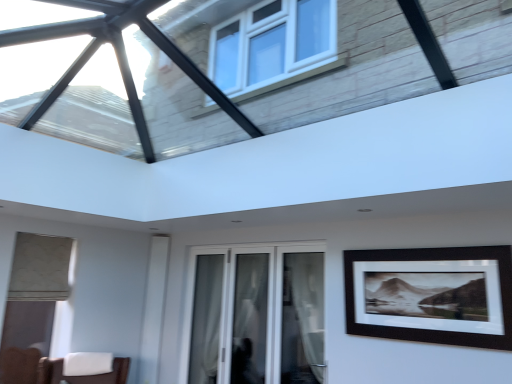
You are a GUI agent. You are given a task and a screenshot of the screen. Output one action in this format:
    pyautogui.click(x=<x>, y=<y>)
    Task: Click on the black matte picture frame at right
    The image size is (512, 384).
    Given the screenshot: What is the action you would take?
    pyautogui.click(x=431, y=295)

How much space does white sheer curtain at center, positioned as the second curtain in back-to-front order, occupy vertically?

3.77 feet.

The image size is (512, 384). I want to click on white glass door at center, so click(255, 315).

Is white sheer curtain at center, the second curtain in the left-to-right sequence, not inside black matte picture frame at right?

That's correct, white sheer curtain at center, the second curtain in the left-to-right sequence, is outside of black matte picture frame at right.

Which object is closer to the camera, white sheer curtain at center, the second curtain in the left-to-right sequence, or black matte picture frame at right?

Positioned in front is black matte picture frame at right.

Locate an element on the screen. This screenshot has height=384, width=512. picture frame in front of the white sheer curtain at center, the second curtain in the left-to-right sequence is located at coordinates (431, 295).

Is white sheer curtain at center, which is counted as the first curtain, starting from the right, directly adjacent to black matte picture frame at right?

white sheer curtain at center, which is counted as the first curtain, starting from the right, is not next to black matte picture frame at right, and they're not touching.

In the image, is white glass door at center on the left side or the right side of white sheer curtain at center, positioned as the second curtain in front-to-back order?

From the image, it's evident that white glass door at center is to the right of white sheer curtain at center, positioned as the second curtain in front-to-back order.

Between white glass door at center and white sheer curtain at center, which is the 1th curtain in left-to-right order, which one has more height?

With more height is white glass door at center.

This screenshot has width=512, height=384. There is a white sheer curtain at center, which is the 1th curtain in left-to-right order. Identify the location of window above it (from a real-world perspective). (255, 315).

From a real-world perspective, which object rests below the other?

white sheer curtain at center, positioned as the second curtain in front-to-back order.

Considering the relative sizes of white sheer curtain at center, which is counted as the 2th curtain, starting from the right, and white sheer curtain at center, which appears as the first curtain when viewed from the front, in the image provided, is white sheer curtain at center, which is counted as the 2th curtain, starting from the right, smaller than white sheer curtain at center, which appears as the first curtain when viewed from the front,?

Yes.

Considering the relative positions of white sheer curtain at center, which is counted as the 2th curtain, starting from the right, and white sheer curtain at center, positioned as the second curtain in back-to-front order, in the image provided, is white sheer curtain at center, which is counted as the 2th curtain, starting from the right, behind white sheer curtain at center, positioned as the second curtain in back-to-front order,?

That is True.

Is white sheer curtain at center, positioned as the second curtain in front-to-back order, inside the boundaries of white sheer curtain at center, the second curtain in the left-to-right sequence, or outside?

white sheer curtain at center, positioned as the second curtain in front-to-back order, lies outside white sheer curtain at center, the second curtain in the left-to-right sequence.

From the image's perspective, is white sheer curtain at center, which is the 1th curtain in left-to-right order, positioned above or below white sheer curtain at center, the second curtain in the left-to-right sequence?

From the image's perspective, white sheer curtain at center, which is the 1th curtain in left-to-right order, appears below white sheer curtain at center, the second curtain in the left-to-right sequence.

In the scene shown: Considering the relative positions of black matte picture frame at right and white sheer curtain at center, positioned as the second curtain in back-to-front order, in the image provided, is black matte picture frame at right to the left of white sheer curtain at center, positioned as the second curtain in back-to-front order, from the viewer's perspective?

No, black matte picture frame at right is not to the left of white sheer curtain at center, positioned as the second curtain in back-to-front order.

At what (x,y) coordinates should I click in order to perform the action: click on picture frame located in front of the white sheer curtain at center, positioned as the second curtain in back-to-front order. Please return your answer as a coordinate pair (x, y). This screenshot has width=512, height=384. Looking at the image, I should click on (431, 295).

In the image, is black matte picture frame at right positioned in front of or behind white sheer curtain at center, positioned as the second curtain in back-to-front order?

black matte picture frame at right is in front of white sheer curtain at center, positioned as the second curtain in back-to-front order.

From the image's perspective, would you say black matte picture frame at right is shown under white sheer curtain at center, which is counted as the first curtain, starting from the right?

Actually, black matte picture frame at right appears above white sheer curtain at center, which is counted as the first curtain, starting from the right, in the image.

Is black matte picture frame at right oriented away from white glass door at center?

black matte picture frame at right does not have its back to white glass door at center.

Does black matte picture frame at right have a smaller size compared to white glass door at center?

Indeed, black matte picture frame at right has a smaller size compared to white glass door at center.

Is the position of black matte picture frame at right less distant than that of white glass door at center?

Yes, black matte picture frame at right is closer to the camera.

Who is taller, white glass door at center or black matte picture frame at right?

Standing taller between the two is white glass door at center.

Which object is closer to the camera, white glass door at center or black matte picture frame at right?

black matte picture frame at right is closer to the camera.

From a real-world perspective, which is physically below, white glass door at center or black matte picture frame at right?

From a 3D spatial view, white glass door at center is below.

Does point (316, 378) appear closer or farther from the camera than point (194, 354)?

Point (316, 378).

Considering the positions of objects white sheer curtain at center, positioned as the second curtain in back-to-front order, and white sheer curtain at center, which is the first curtain from back to front, in the image provided, who is more to the right, white sheer curtain at center, positioned as the second curtain in back-to-front order, or white sheer curtain at center, which is the first curtain from back to front,?

white sheer curtain at center, positioned as the second curtain in back-to-front order, is more to the right.

Is white sheer curtain at center, positioned as the second curtain in back-to-front order, looking in the opposite direction of white sheer curtain at center, which is the first curtain from back to front?

No, white sheer curtain at center, positioned as the second curtain in back-to-front order, is not facing the opposite direction of white sheer curtain at center, which is the first curtain from back to front.

Is white sheer curtain at center, positioned as the second curtain in back-to-front order, positioned far away from white sheer curtain at center, which is the first curtain from back to front?

white sheer curtain at center, positioned as the second curtain in back-to-front order, is positioned a significant distance from white sheer curtain at center, which is the first curtain from back to front.

Where is `picture frame positioned vertically above the white sheer curtain at center, positioned as the second curtain in back-to-front order (from a real-world perspective)`? Image resolution: width=512 pixels, height=384 pixels. picture frame positioned vertically above the white sheer curtain at center, positioned as the second curtain in back-to-front order (from a real-world perspective) is located at coordinates (431, 295).

What are the coordinates of `curtain that is below the white glass door at center (from the image's perspective)` in the screenshot? It's located at (206, 319).

Considering their positions, is white glass door at center positioned closer to black matte picture frame at right than white sheer curtain at center, which is counted as the 2th curtain, starting from the right?

The object closer to black matte picture frame at right is white glass door at center.

Estimate the real-world distances between objects in this image. Which object is further from white glass door at center, white sheer curtain at center, which is the first curtain from back to front, or black matte picture frame at right?

Among the two, black matte picture frame at right is located further to white glass door at center.

Estimate the real-world distances between objects in this image. Which object is further from white glass door at center, white sheer curtain at center, which is counted as the first curtain, starting from the right, or black matte picture frame at right?

black matte picture frame at right lies further to white glass door at center than the other object.

Considering their positions, is white glass door at center positioned further to white sheer curtain at center, the second curtain in the left-to-right sequence, than black matte picture frame at right?

Based on the image, black matte picture frame at right appears to be further to white sheer curtain at center, the second curtain in the left-to-right sequence.

When comparing their distances from white sheer curtain at center, positioned as the second curtain in back-to-front order, does black matte picture frame at right or white glass door at center seem closer?

Among the two, white glass door at center is located nearer to white sheer curtain at center, positioned as the second curtain in back-to-front order.

Based on their spatial positions, is white glass door at center or white sheer curtain at center, which is counted as the first curtain, starting from the right, further from white sheer curtain at center, which is the first curtain from back to front?

Among the two, white sheer curtain at center, which is counted as the first curtain, starting from the right, is located further to white sheer curtain at center, which is the first curtain from back to front.

Looking at this image, from the image, which object appears to be farther from white glass door at center, black matte picture frame at right or white sheer curtain at center, positioned as the second curtain in back-to-front order?

black matte picture frame at right is further to white glass door at center.

Which object lies nearer to the anchor point white glass door at center, black matte picture frame at right or white sheer curtain at center, positioned as the second curtain in front-to-back order?

white sheer curtain at center, positioned as the second curtain in front-to-back order, is closer to white glass door at center.

Locate an element on the screen. curtain between white sheer curtain at center, which is counted as the 2th curtain, starting from the right, and black matte picture frame at right from left to right is located at coordinates (303, 318).

Find the location of `window between white sheer curtain at center, positioned as the second curtain in front-to-back order, and black matte picture frame at right from left to right`. window between white sheer curtain at center, positioned as the second curtain in front-to-back order, and black matte picture frame at right from left to right is located at coordinates (255, 315).

Find the location of a particular element. Image resolution: width=512 pixels, height=384 pixels. curtain located between white glass door at center and black matte picture frame at right in the left-right direction is located at coordinates (303, 318).

The width and height of the screenshot is (512, 384). I want to click on window between white sheer curtain at center, positioned as the second curtain in front-to-back order, and white sheer curtain at center, the second curtain in the left-to-right sequence, from left to right, so click(x=255, y=315).